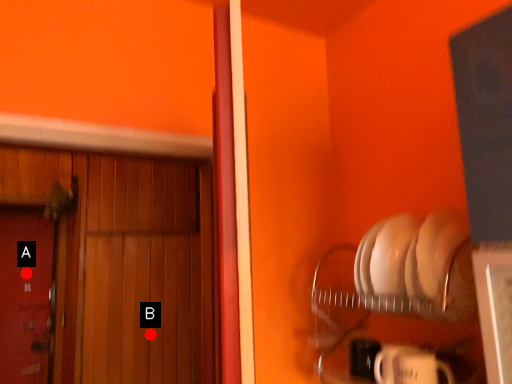
Question: Two points are circled on the image, labeled by A and B beside each circle. Which point is farther to the camera?

Choices:
 (A) A is further
 (B) B is further

Answer: (A)